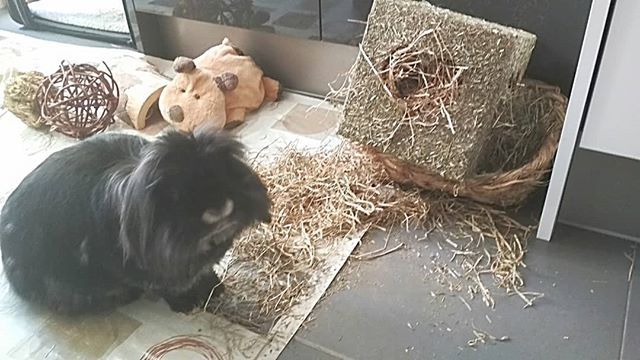
In order to click on floor in this screenshot , I will do `click(603, 261)`, `click(584, 326)`, `click(361, 332)`, `click(388, 275)`, `click(559, 262)`, `click(292, 124)`, `click(20, 40)`, `click(20, 131)`.